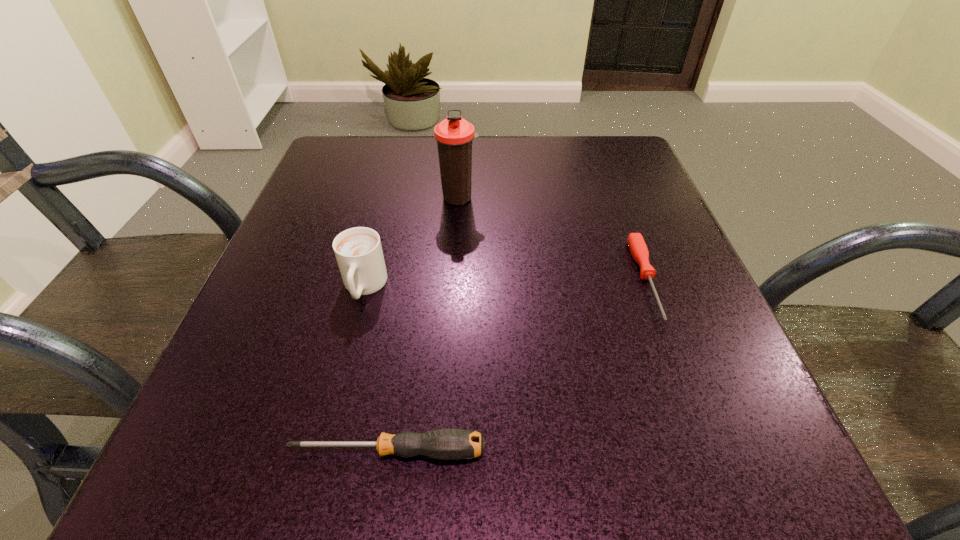
Locate an element on the screen. vacant space at the right edge of the desktop is located at coordinates (756, 411).

Where is `vacant space at the near left corner`? Image resolution: width=960 pixels, height=540 pixels. vacant space at the near left corner is located at coordinates (x=294, y=440).

Locate an element on the screen. vacant space at the far right corner of the desktop is located at coordinates (631, 190).

At what (x,y) coordinates should I click in order to perform the action: click on vacant space at the near right corner. Please return your answer as a coordinate pair (x, y). The image size is (960, 540). Looking at the image, I should click on (689, 489).

In order to click on free point between the third shortest object and the right screwdriver in this screenshot , I will do `click(505, 284)`.

This screenshot has width=960, height=540. Identify the location of unoccupied position between the shorter screwdriver and the tallest object. (553, 239).

Find the location of `empty location between the rightmost object and the second tallest object`. empty location between the rightmost object and the second tallest object is located at coordinates (505, 284).

The width and height of the screenshot is (960, 540). Identify the location of free space between the nearest object and the farthest object. (423, 325).

At what (x,y) coordinates should I click in order to perform the action: click on vacant area that lies between the cappuccino and the taller screwdriver. Please return your answer as a coordinate pair (x, y). Looking at the image, I should click on (376, 369).

Where is `vacant area that lies between the tallest object and the farther screwdriver`? Image resolution: width=960 pixels, height=540 pixels. vacant area that lies between the tallest object and the farther screwdriver is located at coordinates (553, 239).